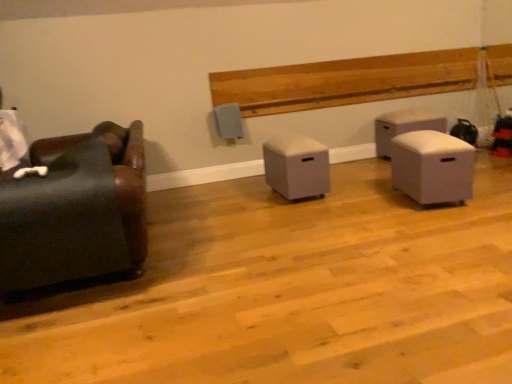
Question: Is white fabric ottoman at right, which appears as the fourth furniture when viewed from the front, bigger or smaller than white fabric ottoman at right, acting as the third furniture starting from the left?

Choices:
 (A) small
 (B) big

Answer: (B)

Question: Choose the correct answer: Is white fabric ottoman at right, the fourth furniture positioned from the left, inside white fabric ottoman at right, which ranks as the third furniture in back-to-front order, or outside it?

Choices:
 (A) outside
 (B) inside

Answer: (A)

Question: Based on their relative distances, which object is farther from the light brown wood paneling at upper center?

Choices:
 (A) white fabric ottoman at right, the second furniture positioned from the front
 (B) white fabric ottoman at right, which is the 1th furniture from back to front
 (C) leather couch at left, which appears as the fourth furniture when viewed from the back
 (D) beige fabric ottoman at center, the second furniture in the left-to-right sequence

Answer: (C)

Question: Based on their relative distances, which object is farther from the beige fabric ottoman at center, the 3th furniture when ordered from right to left?

Choices:
 (A) leather couch at left, which appears as the fourth furniture when viewed from the back
 (B) white fabric ottoman at right, acting as the third furniture starting from the left
 (C) white fabric ottoman at right, the 1th furniture in the right-to-left sequence
 (D) light brown wood paneling at upper center

Answer: (A)